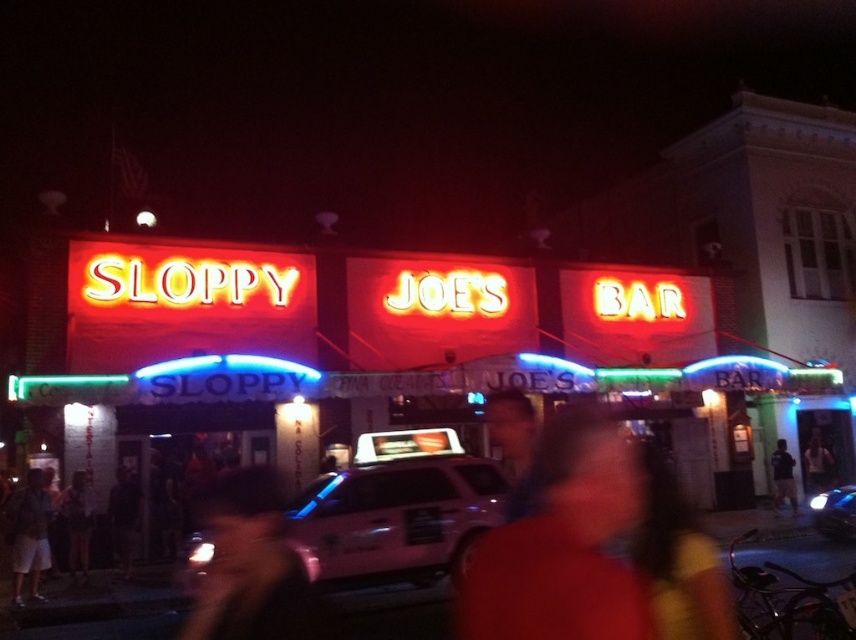
Does point (414, 506) come in front of point (90, 525)?

That is True.

Is white plastic car at center taller than dark hair at lower left?

Yes.

Describe the element at coordinates (396, 509) in the screenshot. I see `white plastic car at center` at that location.

This screenshot has width=856, height=640. I want to click on white plastic car at center, so click(x=396, y=509).

Is camouflage jacket at lower left to the left of dark hair at center from the viewer's perspective?

Correct, you'll find camouflage jacket at lower left to the left of dark hair at center.

Between point (34, 577) and point (125, 518), which one is positioned behind?

The point (125, 518) is more distant.

You are a GUI agent. You are given a task and a screenshot of the screen. Output one action in this format:
    pyautogui.click(x=<x>, y=<y>)
    Task: Click on the camouflage jacket at lower left
    Image resolution: width=856 pixels, height=640 pixels.
    Given the screenshot: What is the action you would take?
    pyautogui.click(x=30, y=534)

Is white plastic car at center wider than dark blue shirt at center?

Yes, white plastic car at center is wider than dark blue shirt at center.

Does white plastic car at center have a larger size compared to dark blue shirt at center?

Yes.

At what (x,y) coordinates should I click in order to perform the action: click on white plastic car at center. Please return your answer as a coordinate pair (x, y). Looking at the image, I should click on pos(396,509).